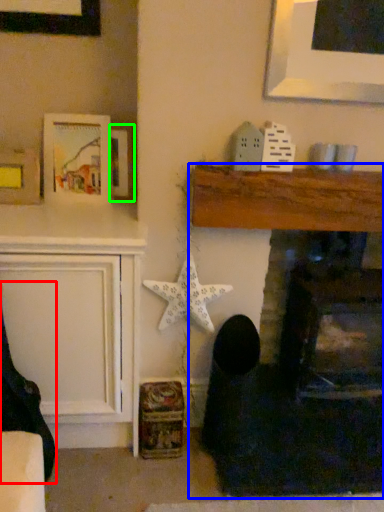
Question: Considering the real-world distances, which object is farthest from rocking chair (highlighted by a red box)? fireplace (highlighted by a blue box) or picture frame (highlighted by a green box)?

Choices:
 (A) fireplace
 (B) picture frame

Answer: (A)